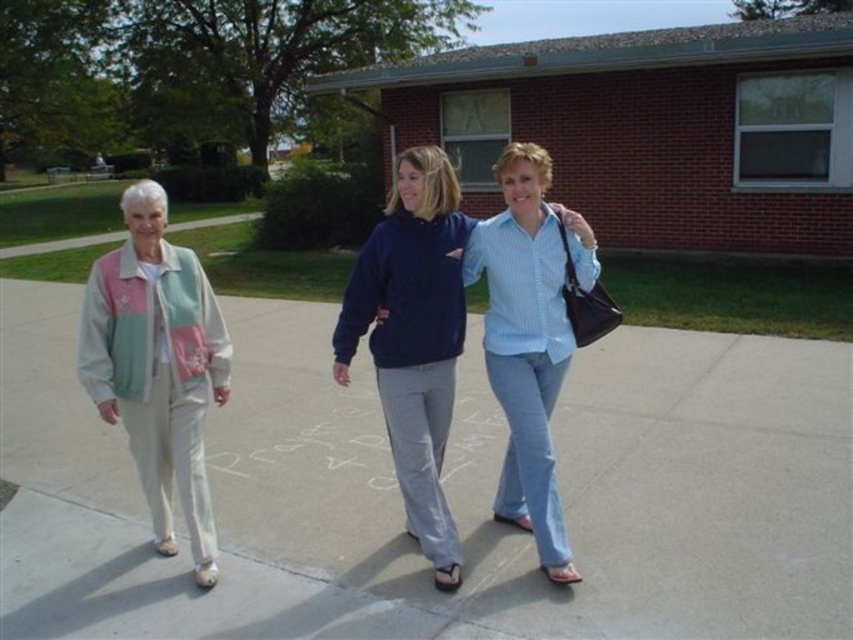
Does point (610, 348) lie in front of point (438, 552)?

No, it is behind (438, 552).

Looking at this image, can you confirm if light gray concrete sidewalk at center is positioned to the left of blue cotton shirt at center?

Correct, you'll find light gray concrete sidewalk at center to the left of blue cotton shirt at center.

Does point (759, 493) come closer to viewer compared to point (431, 276)?

No, (759, 493) is further to viewer.

Where is `light gray concrete sidewalk at center`? This screenshot has height=640, width=853. light gray concrete sidewalk at center is located at coordinates (563, 481).

Does light gray concrete sidewalk at center have a greater height compared to light blue denim jeans at center?

Incorrect, light gray concrete sidewalk at center's height is not larger of light blue denim jeans at center's.

Which is below, light gray concrete sidewalk at center or light blue denim jeans at center?

Positioned lower is light gray concrete sidewalk at center.

What are the coordinates of `light gray concrete sidewalk at center` in the screenshot? It's located at (563, 481).

Locate an element on the screen. light gray concrete sidewalk at center is located at coordinates (563, 481).

Between point (695, 410) and point (160, 548), which one is positioned in front?

Positioned in front is point (160, 548).

Is light gray concrete sidewalk at center in front of light beige fabric jacket at left?

Yes, it is.

Does point (640, 474) come farther from viewer compared to point (148, 468)?

Yes, point (640, 474) is farther from viewer.

Locate an element on the screen. Image resolution: width=853 pixels, height=640 pixels. light gray concrete sidewalk at center is located at coordinates (563, 481).